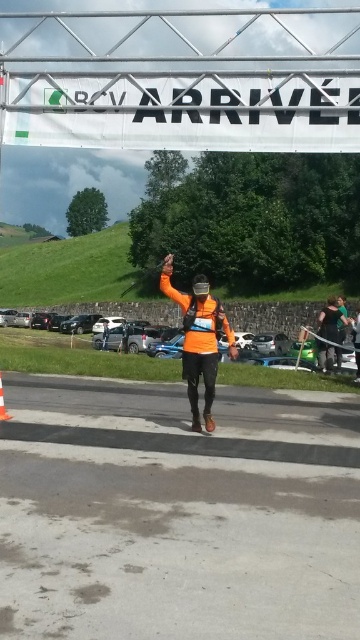
Question: Can you confirm if smooth asphalt road at center is positioned above orange matte safety vest at center?

Choices:
 (A) yes
 (B) no

Answer: (B)

Question: Does green fabric jacket at center appear under orange plastic traffic cone at center?

Choices:
 (A) no
 (B) yes

Answer: (A)

Question: Considering the real-world distances, which object is farthest from the orange matte running suit at center?

Choices:
 (A) smooth asphalt road at center
 (B) orange matte safety vest at center
 (C) orange plastic traffic cone at center

Answer: (C)

Question: Which point is closer to the camera?

Choices:
 (A) (306, 493)
 (B) (336, 339)
 (C) (1, 412)
 (D) (205, 344)

Answer: (A)

Question: Does smooth asphalt road at center have a lesser width compared to orange matte safety vest at center?

Choices:
 (A) yes
 (B) no

Answer: (B)

Question: Which of these objects is positioned farthest from the orange matte safety vest at center?

Choices:
 (A) orange matte running suit at center
 (B) green fabric jacket at center

Answer: (B)